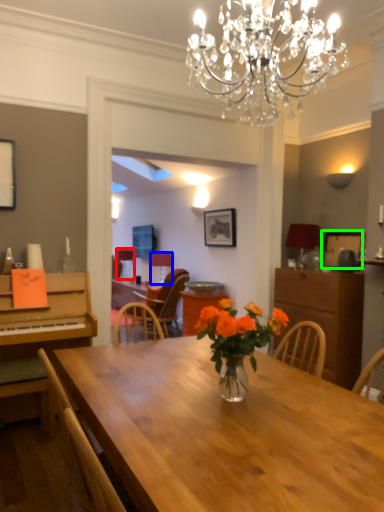
Question: Based on their relative distances, which object is farther from lamp (highlighted by a red box)? Choose from lamp (highlighted by a blue box) and picture frame (highlighted by a green box).

Choices:
 (A) lamp
 (B) picture frame

Answer: (B)